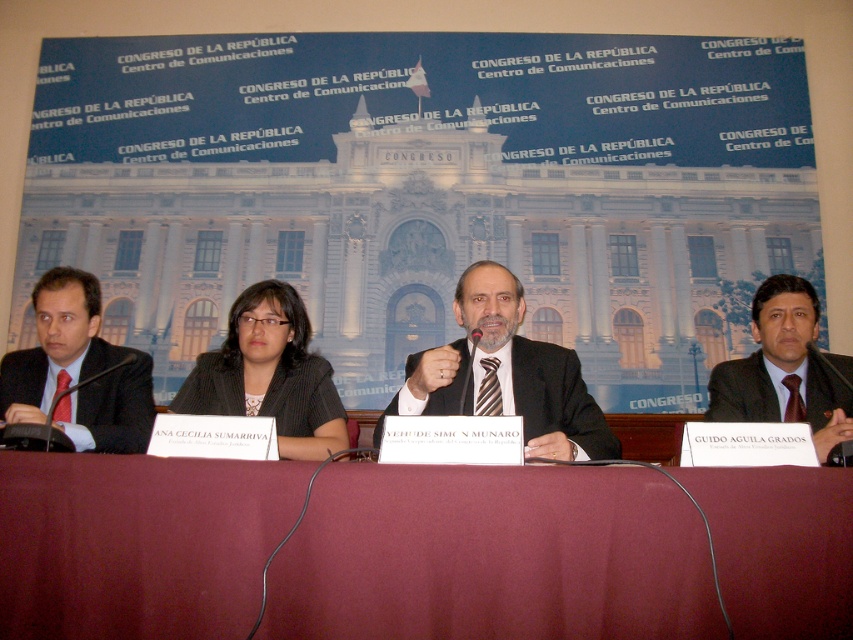
Question: Does burgundy fabric table at center have a greater width compared to matte black suit at right?

Choices:
 (A) no
 (B) yes

Answer: (B)

Question: Which of these objects is positioned farthest from the black textured suit at center?

Choices:
 (A) dark brown textured suit at center
 (B) burgundy fabric table at center

Answer: (B)

Question: Based on their relative distances, which object is farther from the matte black suit at right?

Choices:
 (A) dark brown textured suit at center
 (B) matte black suit at left
 (C) black textured suit at center
 (D) burgundy fabric table at center

Answer: (B)

Question: Is the position of black textured suit at center less distant than that of matte black suit at right?

Choices:
 (A) no
 (B) yes

Answer: (A)

Question: Does matte black suit at right have a smaller size compared to dark brown textured suit at center?

Choices:
 (A) no
 (B) yes

Answer: (B)

Question: Which object appears farthest from the camera in this image?

Choices:
 (A) black textured suit at center
 (B) matte black suit at left
 (C) burgundy fabric table at center
 (D) dark brown textured suit at center

Answer: (A)